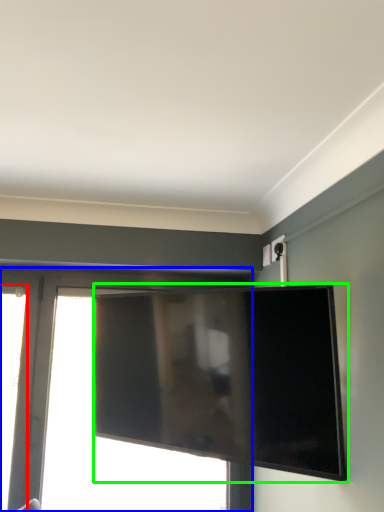
Question: Which object is positioned closest to window (highlighted by a red box)? Select from window (highlighted by a blue box) and television (highlighted by a green box).

Choices:
 (A) window
 (B) television

Answer: (A)